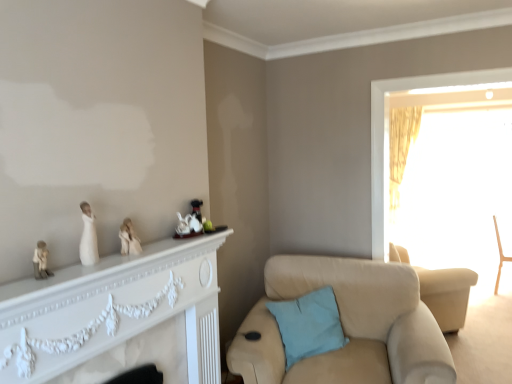
You are a GUI agent. You are given a task and a screenshot of the screen. Output one action in this format:
    pyautogui.click(x=<x>, y=<y>)
    Task: Click on the free space in front of white porcelain teapot at center, marked as the 2th toy in a right-to-left arrangement
    
    Given the screenshot: What is the action you would take?
    pyautogui.click(x=177, y=241)